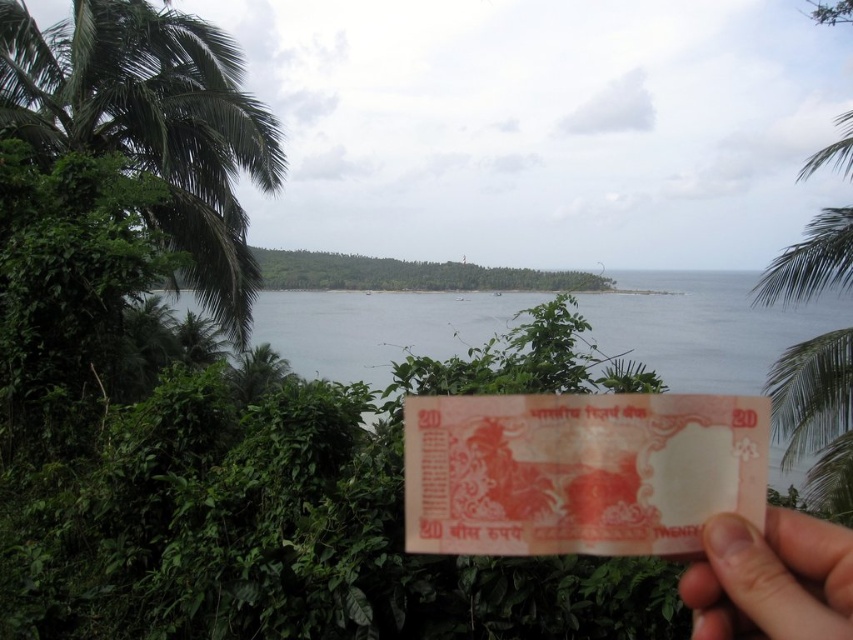
Is green leafy palm tree at right below pink matte paper at lower right?

Correct, green leafy palm tree at right is located below pink matte paper at lower right.

Which of these two, green leafy palm tree at right or pink matte paper at lower right, stands shorter?

Standing shorter between the two is pink matte paper at lower right.

Does point (807, 428) come farther from viewer compared to point (751, 593)?

Yes, it is.

Identify the location of green leafy palm tree at right. (817, 416).

Is the position of pink paper currency at center less distant than that of green leafy palm tree at right?

Yes, pink paper currency at center is in front of green leafy palm tree at right.

Between pink paper currency at center and green leafy palm tree at right, which one has more height?

Standing taller between the two is green leafy palm tree at right.

Is point (482, 442) more distant than point (836, 120)?

No, it is not.

This screenshot has width=853, height=640. Find the location of `pink paper currency at center`. pink paper currency at center is located at coordinates (579, 472).

Between green leafy palm tree at left and pink matte paper at lower right, which one has more height?

green leafy palm tree at left is taller.

Is green leafy palm tree at left in front of pink matte paper at lower right?

No, it is behind pink matte paper at lower right.

The image size is (853, 640). I want to click on green leafy palm tree at left, so click(151, 124).

Image resolution: width=853 pixels, height=640 pixels. In order to click on green leafy palm tree at left in this screenshot , I will do `click(151, 124)`.